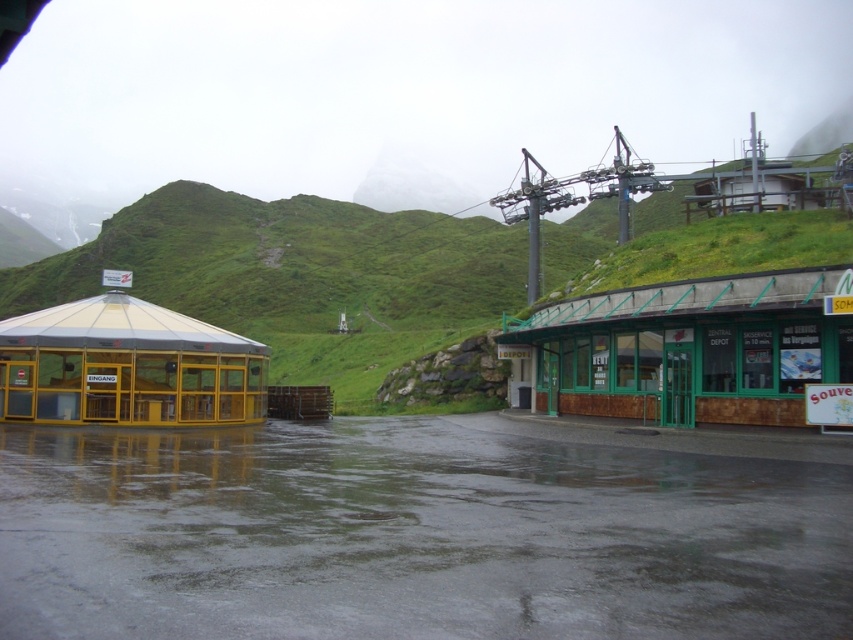
Can you confirm if green wooden hut at center is positioned to the right of transparent glass hut at left?

Indeed, green wooden hut at center is positioned on the right side of transparent glass hut at left.

Between green wooden hut at center and transparent glass hut at left, which one has less height?

Standing shorter between the two is transparent glass hut at left.

At what (x,y) coordinates should I click in order to perform the action: click on green wooden hut at center. Please return your answer as a coordinate pair (x, y). Looking at the image, I should click on tap(688, 349).

The height and width of the screenshot is (640, 853). I want to click on green wooden hut at center, so click(x=688, y=349).